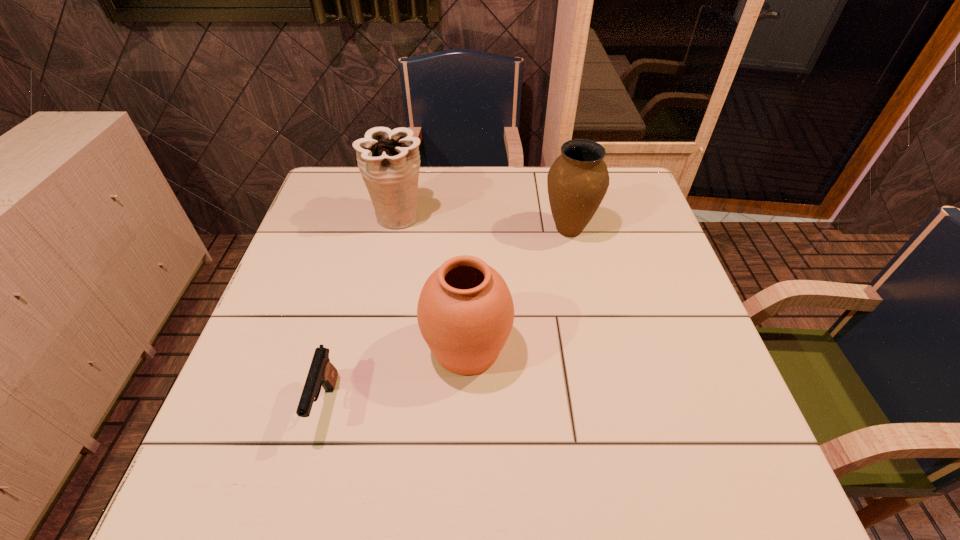
Identify the location of the rightmost urn. (577, 181).

Locate an element on the screen. This screenshot has width=960, height=540. the leftmost urn is located at coordinates (389, 161).

Where is `the nearest urn`? Image resolution: width=960 pixels, height=540 pixels. the nearest urn is located at coordinates (465, 312).

At what (x,y) coordinates should I click in order to perform the action: click on the second urn from right to left. Please return your answer as a coordinate pair (x, y). Looking at the image, I should click on pos(465,312).

Where is `the shortest object`? the shortest object is located at coordinates (322, 372).

Find the location of a particular element. Image resolution: width=960 pixels, height=540 pixels. free space located 0.300m on the front of the rightmost urn is located at coordinates (593, 339).

This screenshot has height=540, width=960. I want to click on vacant space located on the front of the leftmost urn, so click(374, 330).

I want to click on free space located on the front of the nearest urn, so click(x=466, y=420).

Locate an element on the screen. The height and width of the screenshot is (540, 960). vacant space located 0.050m at the barrel of the shortest object is located at coordinates (309, 468).

You are a GUI agent. You are given a task and a screenshot of the screen. Output one action in this format:
    pyautogui.click(x=<x>, y=<y>)
    Task: Click on the free region at the far edge of the desktop
    
    Given the screenshot: What is the action you would take?
    pyautogui.click(x=419, y=210)